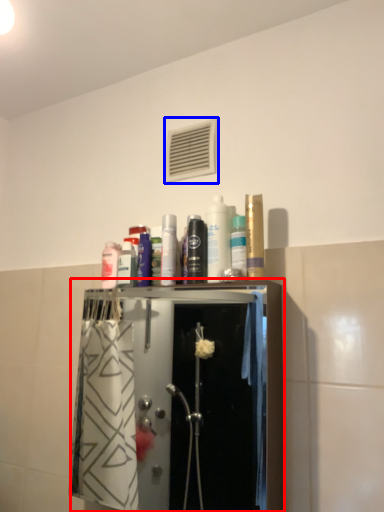
Question: Which of the following is the closest to the observer, closet (highlighted by a red box) or air conditioning (highlighted by a blue box)?

Choices:
 (A) closet
 (B) air conditioning

Answer: (A)